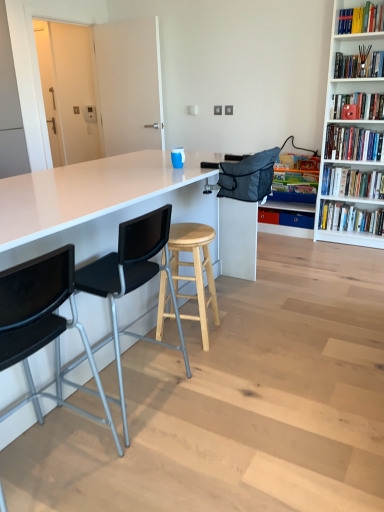
Where is `vacant area that lies to the right of black plastic chair at left, which is the first chair in front-to-back order`? The image size is (384, 512). vacant area that lies to the right of black plastic chair at left, which is the first chair in front-to-back order is located at coordinates (150, 462).